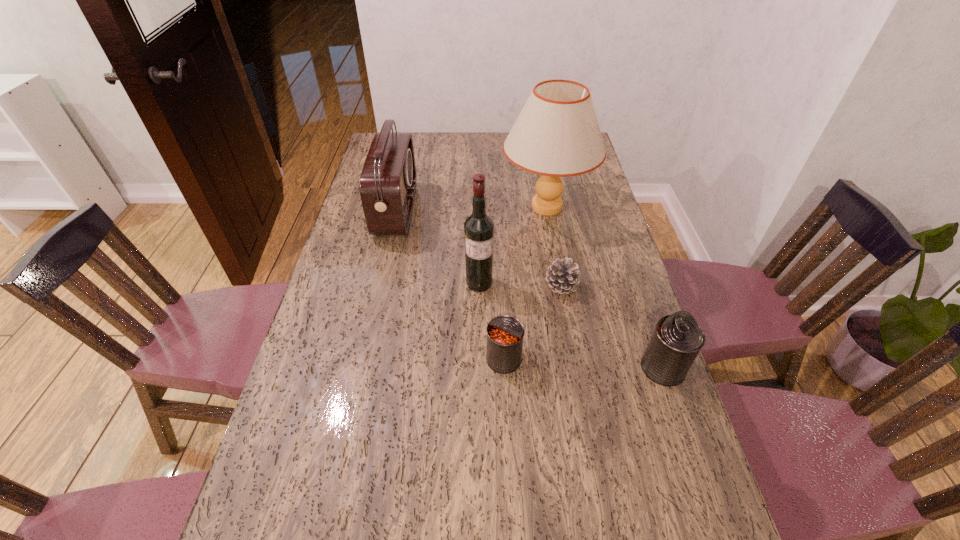
The image size is (960, 540). I want to click on the shorter can, so click(505, 334).

The image size is (960, 540). In order to click on the second shortest object in this screenshot , I will do `click(505, 334)`.

The image size is (960, 540). I want to click on the taller can, so click(677, 339).

At what (x,y) coordinates should I click in order to perform the action: click on the third shortest object. Please return your answer as a coordinate pair (x, y). This screenshot has width=960, height=540. Looking at the image, I should click on (677, 339).

The width and height of the screenshot is (960, 540). I want to click on pinecone, so click(562, 276).

This screenshot has width=960, height=540. Identify the location of the leftmost object. (388, 180).

What are the coordinates of `the third tallest object` in the screenshot? It's located at click(388, 180).

This screenshot has width=960, height=540. Find the location of `lampshade`. lampshade is located at coordinates (557, 134).

Locate an element on the screen. wine bottle is located at coordinates (478, 228).

Identify the location of free space located on the left of the shorter can. The height and width of the screenshot is (540, 960). (463, 359).